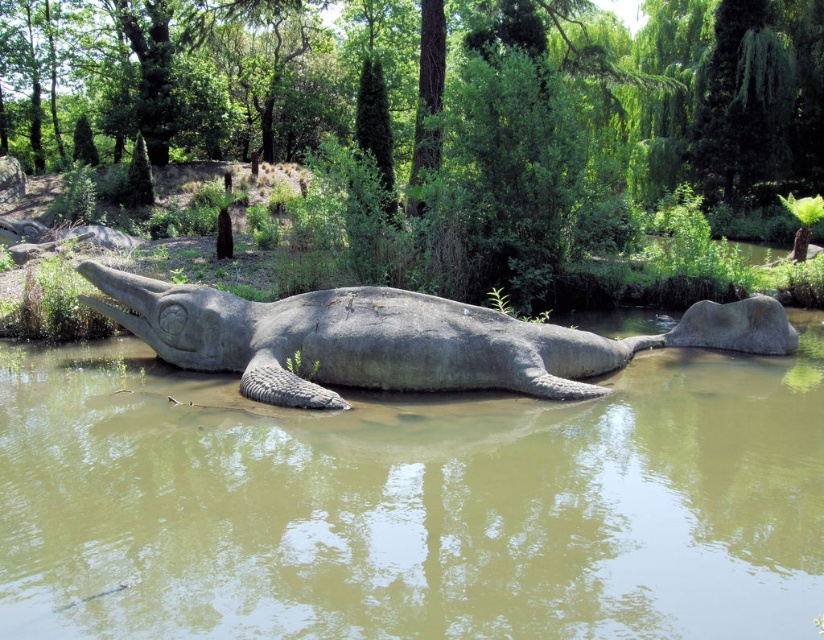
Which is above, brown matte water at center or gray stone crocodile at center?

gray stone crocodile at center is above.

Does brown matte water at center appear on the left side of gray stone crocodile at center?

In fact, brown matte water at center is to the right of gray stone crocodile at center.

What do you see at coordinates (412, 502) in the screenshot? I see `brown matte water at center` at bounding box center [412, 502].

Locate an element on the screen. Image resolution: width=824 pixels, height=640 pixels. brown matte water at center is located at coordinates (412, 502).